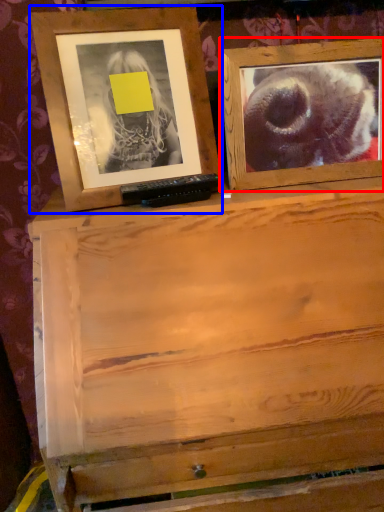
Question: Which point is further to the camera, picture frame (highlighted by a red box) or picture frame (highlighted by a blue box)?

Choices:
 (A) picture frame
 (B) picture frame

Answer: (A)